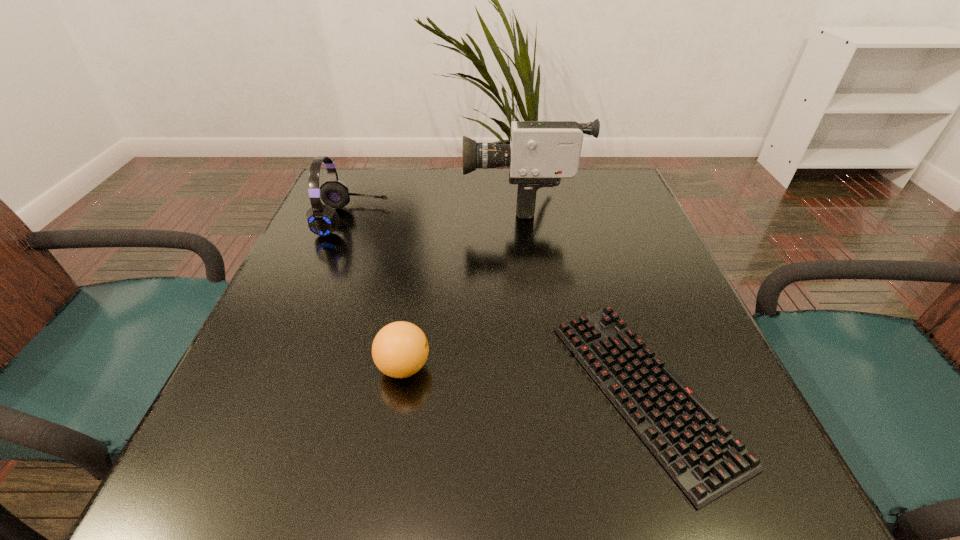
Identify the location of free location located on the side with brand of the ping-pong ball. (660, 367).

Locate an element on the screen. The height and width of the screenshot is (540, 960). free region located on the left of the computer keyboard is located at coordinates [x=488, y=391].

Locate an element on the screen. The width and height of the screenshot is (960, 540). camcorder situated at the far edge is located at coordinates (540, 153).

What are the coordinates of `headset that is positioned at the far edge` in the screenshot? It's located at (323, 220).

In order to click on object that is positioned at the near edge in this screenshot , I will do `click(700, 453)`.

Image resolution: width=960 pixels, height=540 pixels. I want to click on object present at the left edge, so click(x=323, y=220).

The width and height of the screenshot is (960, 540). In order to click on camcorder present at the right edge in this screenshot , I will do `click(540, 153)`.

Where is `computer keyboard at the right edge`? This screenshot has width=960, height=540. computer keyboard at the right edge is located at coordinates (700, 453).

The image size is (960, 540). I want to click on object that is positioned at the far left corner, so click(323, 220).

Find the location of a particular element. The height and width of the screenshot is (540, 960). object present at the far right corner is located at coordinates [540, 153].